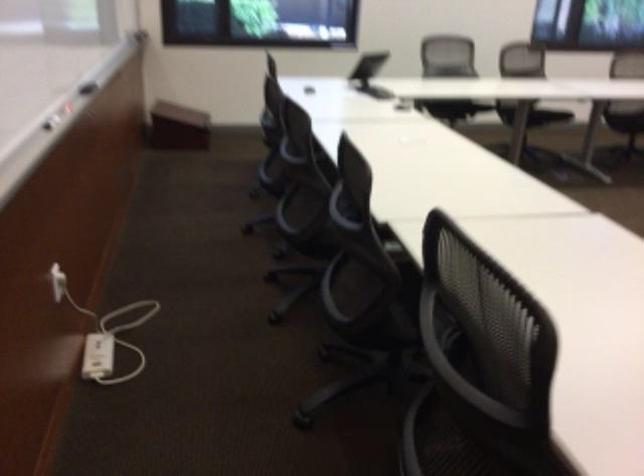
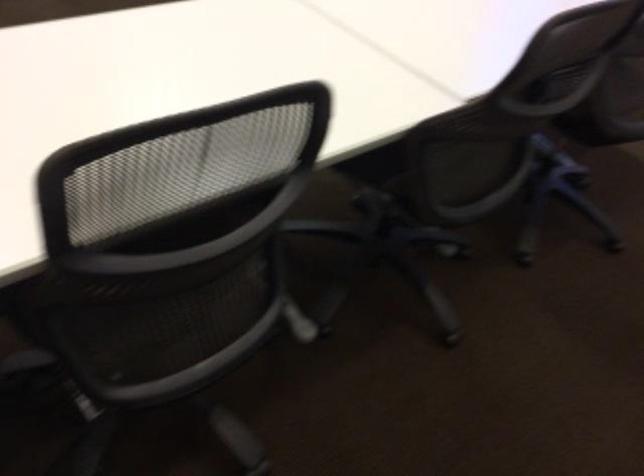
How did the camera likely rotate?

The camera rotated toward right-down.